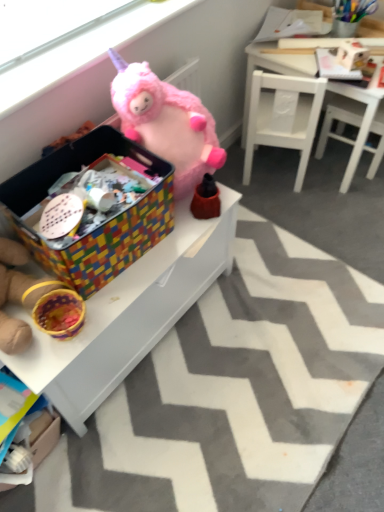
Locate an element on the screen. vacant space underneath white matte chair at upper right (from a real-world perspective) is located at coordinates (269, 176).